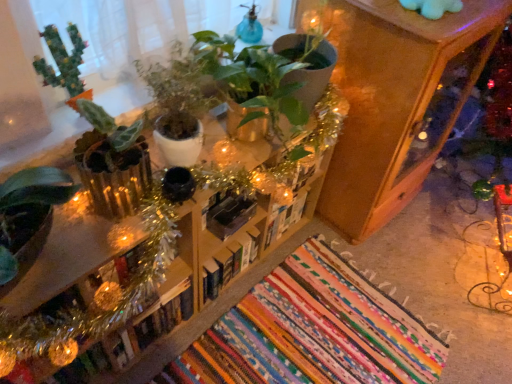
You are a GUI agent. You are given a task and a screenshot of the screen. Output one action in this format:
    pyautogui.click(x=<x>, y=<y>)
    Task: Click on the free space to the right of wooden cabinet at upper right
    The height and width of the screenshot is (384, 512).
    Given the screenshot: What is the action you would take?
    pyautogui.click(x=448, y=223)